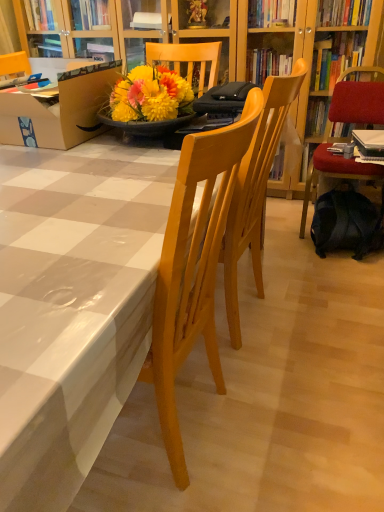
Locate an element on the screen. light wood chair at center, which appears as the first chair when viewed from the left is located at coordinates click(x=255, y=191).

What do you see at coordinates (347, 224) in the screenshot? The width and height of the screenshot is (384, 512). I see `black fabric backpack at lower right` at bounding box center [347, 224].

What is the approximate height of black fabric backpack at lower right?

black fabric backpack at lower right is 22.85 centimeters tall.

The image size is (384, 512). What do you see at coordinates (347, 122) in the screenshot? I see `velvet red chair at right, the first chair from the right` at bounding box center [347, 122].

Where is `brown cardboard box at left`? Image resolution: width=384 pixels, height=512 pixels. brown cardboard box at left is located at coordinates (x=59, y=110).

What are the coordinates of `light wood chair at center, the second chair when ordered from back to front` in the screenshot? It's located at (255, 191).

Consider the image. Who is bigger, light wood chair at center, the second chair when ordered from back to front, or brown cardboard box at left?

Bigger between the two is light wood chair at center, the second chair when ordered from back to front.

The height and width of the screenshot is (512, 384). I want to click on box that appears behind the light wood chair at center, the second chair when ordered from back to front, so (x=59, y=110).

Does point (240, 231) appear closer or farther from the camera than point (54, 115)?

Clearly, point (240, 231) is more distant from the camera than point (54, 115).

Is brown cardboard box at left oriented away from light wood chair at center, which is the first chair from front to back?

No, brown cardboard box at left is not facing the opposite direction of light wood chair at center, which is the first chair from front to back.

Does brown cardboard box at left have a greater height compared to light wood chair at center, the 2th chair viewed from the right?

No, brown cardboard box at left is not taller than light wood chair at center, the 2th chair viewed from the right.

Is brown cardboard box at left at the right side of light wood chair at center, which is the first chair from front to back?

In fact, brown cardboard box at left is to the left of light wood chair at center, which is the first chair from front to back.

Considering the positions of points (44, 133) and (246, 170), is point (44, 133) farther from camera compared to point (246, 170)?

Yes, it is behind point (246, 170).

Can you confirm if light wood chair at center, which is the first chair from front to back, is thinner than black fabric backpack at lower right?

Incorrect, the width of light wood chair at center, which is the first chair from front to back, is not less than that of black fabric backpack at lower right.

Considering the points (288, 89) and (350, 227), which point is in front, point (288, 89) or point (350, 227)?

The point (288, 89) is more forward.

Between light wood chair at center, which appears as the first chair when viewed from the left, and black fabric backpack at lower right, which one has larger size?

With larger size is light wood chair at center, which appears as the first chair when viewed from the left.

Between point (331, 191) and point (342, 178), which one is positioned in front?

The point (342, 178) is closer.

Based on the photo, between black fabric backpack at lower right and velvet red chair at right, the first chair from the right, which one has larger width?

velvet red chair at right, the first chair from the right, is wider.

Does black fabric backpack at lower right appear on the right side of velvet red chair at right, the second chair when ordered from left to right?

In fact, black fabric backpack at lower right is to the left of velvet red chair at right, the second chair when ordered from left to right.

You are a GUI agent. You are given a task and a screenshot of the screen. Output one action in this format:
    pyautogui.click(x=<x>, y=<y>)
    Task: Click on the backpack lying behind the velvet red chair at right, the first chair from the right
    This screenshot has width=384, height=512.
    Given the screenshot: What is the action you would take?
    pyautogui.click(x=347, y=224)

Between white glossy table at center and velvet red chair at right, which ranks as the 1th chair in back-to-front order, which one appears on the left side from the viewer's perspective?

white glossy table at center is more to the left.

Considering the sizes of objects white glossy table at center and velvet red chair at right, the second chair positioned from the front, in the image provided, who is smaller, white glossy table at center or velvet red chair at right, the second chair positioned from the front,?

With smaller size is white glossy table at center.

The height and width of the screenshot is (512, 384). I want to click on kitchen & dining room table below the velvet red chair at right, the first chair from the right (from the image's perspective), so click(x=73, y=306).

From a real-world perspective, which is physically below, white glossy table at center or black fabric backpack at lower right?

black fabric backpack at lower right is physically lower.

Relative to black fabric backpack at lower right, is white glossy table at center in front or behind?

white glossy table at center is in front of black fabric backpack at lower right.

Can you see white glossy table at center touching black fabric backpack at lower right?

No, white glossy table at center is not touching black fabric backpack at lower right.

Considering the sizes of white glossy table at center and black fabric backpack at lower right in the image, is white glossy table at center wider or thinner than black fabric backpack at lower right?

Considering their sizes, white glossy table at center looks broader than black fabric backpack at lower right.

How far apart are white glossy table at center and brown cardboard box at left?

They are 54.78 centimeters apart.

Would you say white glossy table at center is a long distance from brown cardboard box at left?

white glossy table at center is actually quite close to brown cardboard box at left.

Could you tell me if white glossy table at center is facing brown cardboard box at left?

No, white glossy table at center is not oriented towards brown cardboard box at left.

Find the location of `box above the light wood chair at center, the second chair when ordered from back to front (from the image's perspective)`. box above the light wood chair at center, the second chair when ordered from back to front (from the image's perspective) is located at coordinates (59, 110).

Identify the location of box positioned vertically above the light wood chair at center, which is the first chair from front to back (from a real-world perspective). (59, 110).

Based on the photo, from the image, which object appears to be nearer to light wood chair at center, the 2th chair viewed from the right, white glossy table at center or black fabric backpack at lower right?

white glossy table at center.

Looking at the image, which one is located further to black fabric backpack at lower right, light wood chair at center, the 2th chair viewed from the right, or white glossy table at center?

white glossy table at center is further to black fabric backpack at lower right.

Based on their spatial positions, is light wood chair at center, the 2th chair viewed from the right, or black fabric backpack at lower right closer to brown cardboard box at left?

light wood chair at center, the 2th chair viewed from the right, lies closer to brown cardboard box at left than the other object.

From the image, which object appears to be nearer to white glossy table at center, velvet red chair at right, the second chair when ordered from left to right, or brown cardboard box at left?

Among the two, brown cardboard box at left is located nearer to white glossy table at center.

Consider the image. Based on their spatial positions, is brown cardboard box at left or white glossy table at center further from light wood chair at center, which is the first chair from front to back?

Based on the image, brown cardboard box at left appears to be further to light wood chair at center, which is the first chair from front to back.

From the image, which object appears to be farther from white glossy table at center, black fabric backpack at lower right or light wood chair at center, the second chair when ordered from back to front?

black fabric backpack at lower right lies further to white glossy table at center than the other object.

Considering their positions, is white glossy table at center positioned further to light wood chair at center, which appears as the first chair when viewed from the left, than velvet red chair at right, the first chair from the right?

The object further to light wood chair at center, which appears as the first chair when viewed from the left, is velvet red chair at right, the first chair from the right.

Estimate the real-world distances between objects in this image. Which object is closer to white glossy table at center, light wood chair at center, which is the first chair from front to back, or velvet red chair at right, the second chair positioned from the front?

light wood chair at center, which is the first chair from front to back, lies closer to white glossy table at center than the other object.

The width and height of the screenshot is (384, 512). Identify the location of chair between white glossy table at center and velvet red chair at right, the second chair when ordered from left to right, from front to back. (255, 191).

Locate an element on the screen. kitchen & dining room table between brown cardboard box at left and velvet red chair at right, the first chair from the right, in the horizontal direction is located at coordinates (73, 306).

Locate an element on the screen. The image size is (384, 512). backpack situated between brown cardboard box at left and velvet red chair at right, the second chair when ordered from left to right, from left to right is located at coordinates (347, 224).

Where is `chair positioned between light wood chair at center, the 2th chair viewed from the right, and black fabric backpack at lower right from near to far`? chair positioned between light wood chair at center, the 2th chair viewed from the right, and black fabric backpack at lower right from near to far is located at coordinates (347, 122).